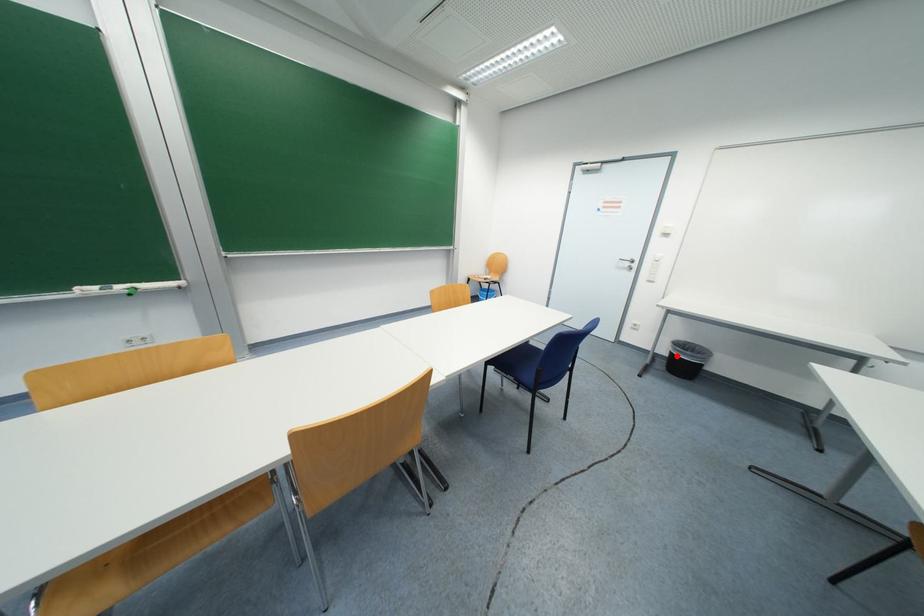
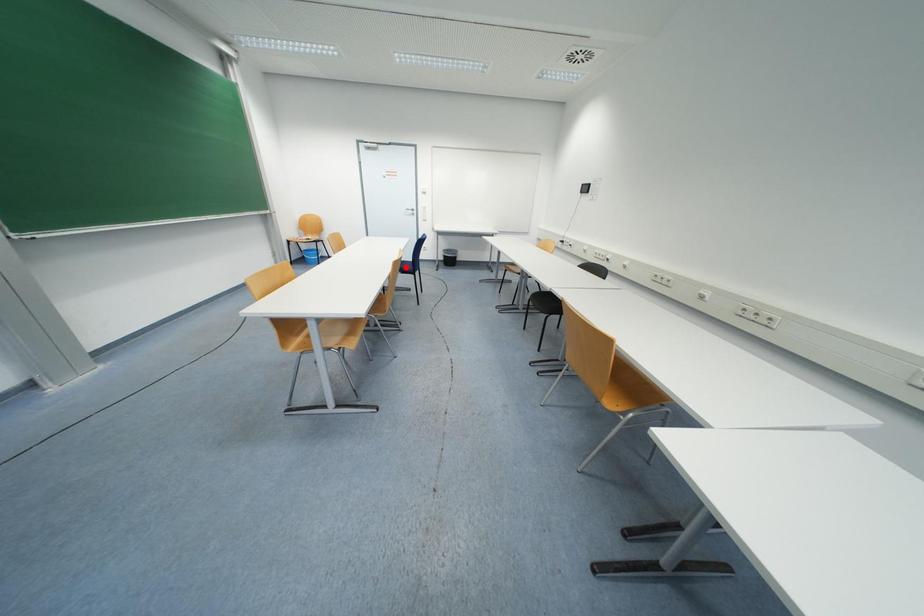
I am providing you with two images of the same scene from different viewpoints. A red point is marked on the first image and another point is marked on the second image. Does the point marked in image1 correspond to the same location as the one in image2?

No